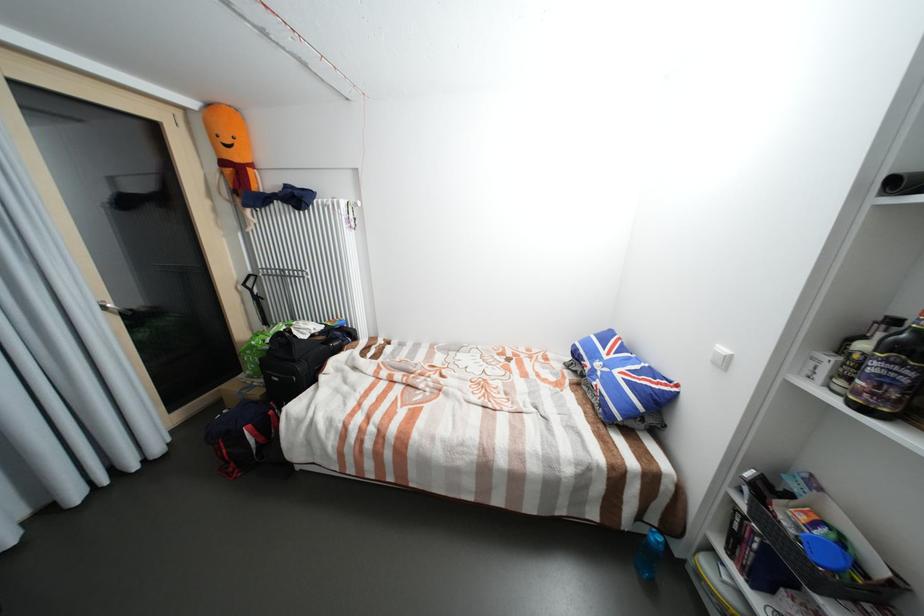
I want to click on blue plastic lid, so click(x=825, y=553).